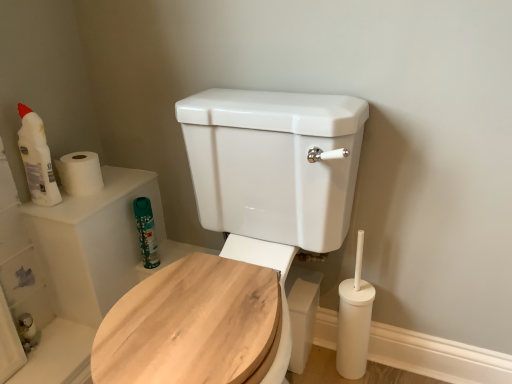
Where is `free spot in front of white matte toilet paper at upper left`? This screenshot has width=512, height=384. free spot in front of white matte toilet paper at upper left is located at coordinates coord(77,206).